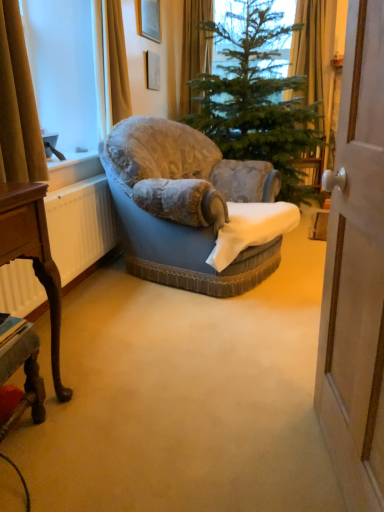
Image resolution: width=384 pixels, height=512 pixels. I want to click on free space between wooden polished desk at lower left, which is the 1th desk from top to bottom, and velvet blue armchair at center, so click(127, 347).